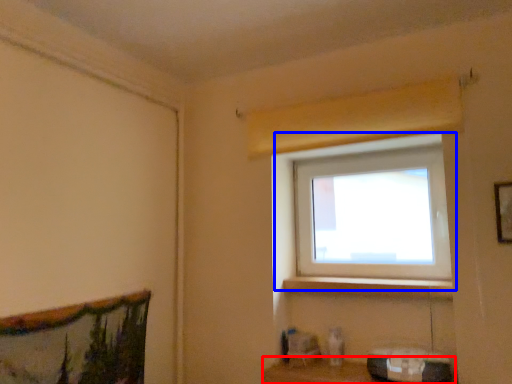
Question: Which object is further to the camera taking this photo, shelf (highlighted by a red box) or window (highlighted by a blue box)?

Choices:
 (A) shelf
 (B) window

Answer: (B)